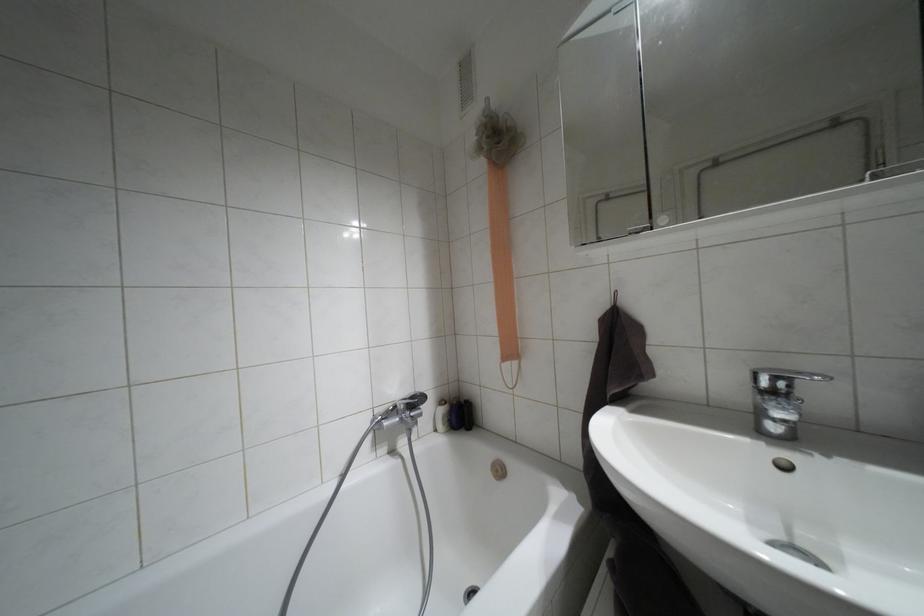
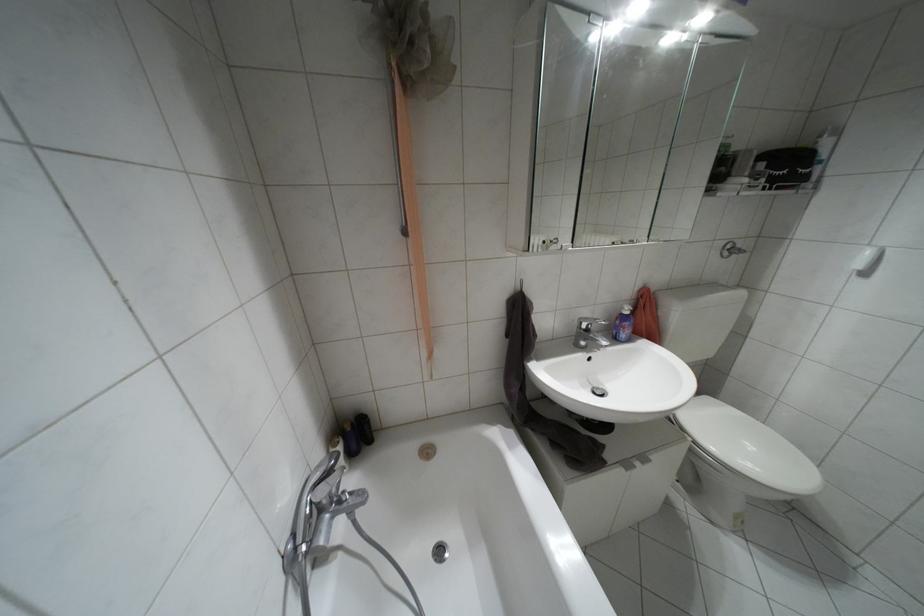
How did the camera likely rotate?

The camera's rotation is toward right-down.